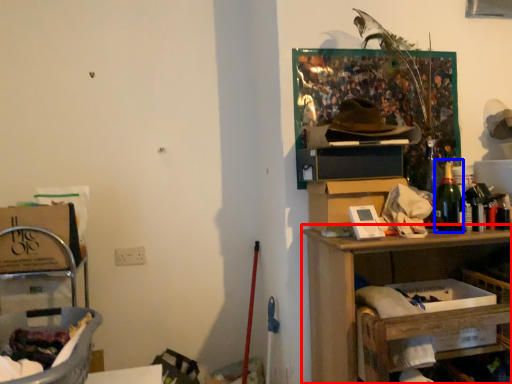
Question: Which object is further to the camera taking this photo, shelf (highlighted by a red box) or bottle (highlighted by a blue box)?

Choices:
 (A) shelf
 (B) bottle

Answer: (B)